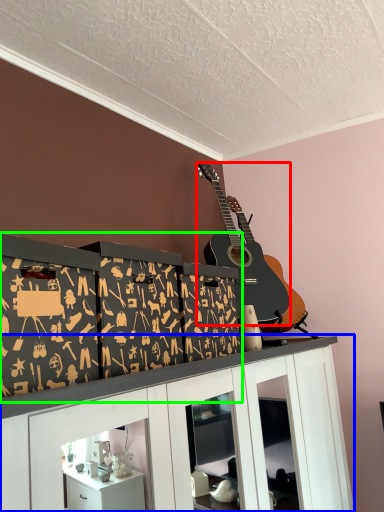
Question: Based on their relative distances, which object is nearer to guitar (highlighted by a red box)? Choose from cabinetry (highlighted by a blue box) and shelf (highlighted by a green box).

Choices:
 (A) cabinetry
 (B) shelf

Answer: (B)